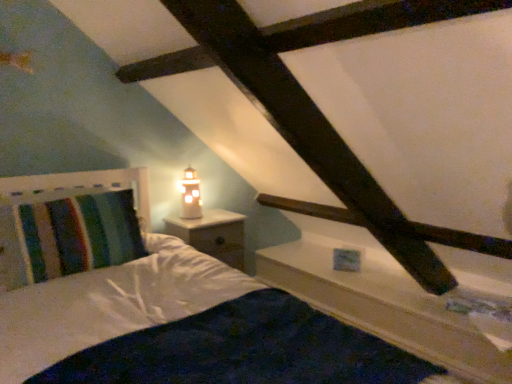
Question: Considering the relative positions of white wood ledge at upper right and striped fabric pillow at left in the image provided, is white wood ledge at upper right to the right of striped fabric pillow at left from the viewer's perspective?

Choices:
 (A) yes
 (B) no

Answer: (A)

Question: From the image's perspective, is white wood ledge at upper right under striped fabric pillow at left?

Choices:
 (A) no
 (B) yes

Answer: (B)

Question: Is white wood ledge at upper right oriented away from striped fabric pillow at left?

Choices:
 (A) yes
 (B) no

Answer: (B)

Question: From a real-world perspective, is white wood ledge at upper right positioned under striped fabric pillow at left based on gravity?

Choices:
 (A) no
 (B) yes

Answer: (B)

Question: Could you tell me if white wood ledge at upper right is facing striped fabric pillow at left?

Choices:
 (A) no
 (B) yes

Answer: (A)

Question: From a real-world perspective, is white wood ledge at upper right over striped fabric pillow at left?

Choices:
 (A) yes
 (B) no

Answer: (B)

Question: Considering the relative positions of white wood nightstand at center and matte glass table lamp at upper center in the image provided, is white wood nightstand at center to the right of matte glass table lamp at upper center from the viewer's perspective?

Choices:
 (A) no
 (B) yes

Answer: (B)

Question: Is white wood nightstand at center shorter than matte glass table lamp at upper center?

Choices:
 (A) yes
 (B) no

Answer: (B)

Question: Considering the relative sizes of white wood nightstand at center and matte glass table lamp at upper center in the image provided, is white wood nightstand at center wider than matte glass table lamp at upper center?

Choices:
 (A) yes
 (B) no

Answer: (A)

Question: From a real-world perspective, is white wood nightstand at center beneath matte glass table lamp at upper center?

Choices:
 (A) no
 (B) yes

Answer: (B)

Question: Is the surface of white wood nightstand at center in direct contact with matte glass table lamp at upper center?

Choices:
 (A) yes
 (B) no

Answer: (B)

Question: Is white wood nightstand at center closer to the viewer compared to matte glass table lamp at upper center?

Choices:
 (A) no
 (B) yes

Answer: (B)

Question: Is the depth of white wood nightstand at center less than that of striped fabric pillow at left?

Choices:
 (A) yes
 (B) no

Answer: (B)